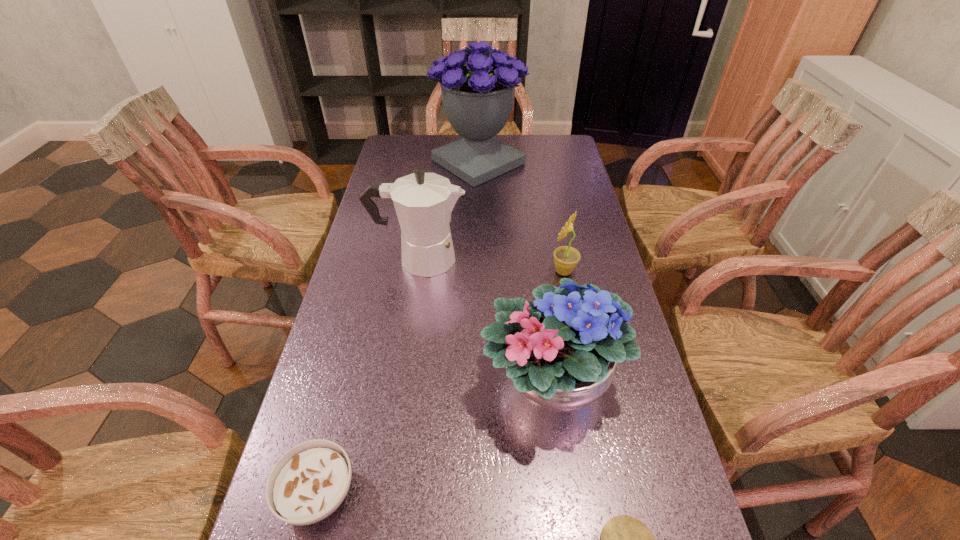
The image size is (960, 540). I want to click on blank area located 0.230m on the left of the nearer bouquet, so pyautogui.click(x=377, y=380).

Locate an element on the screen. This screenshot has width=960, height=540. vacant space located 0.370m on the face of the sunflower is located at coordinates (418, 272).

You are a GUI agent. You are given a task and a screenshot of the screen. Output one action in this format:
    pyautogui.click(x=<x>, y=<y>)
    Task: Click on the free spot located 0.270m on the face of the sunflower
    Image resolution: width=960 pixels, height=540 pixels.
    Given the screenshot: What is the action you would take?
    pyautogui.click(x=453, y=272)

I want to click on free space located 0.260m on the face of the sunflower, so click(457, 272).

At what (x,y) coordinates should I click in order to perform the action: click on free space located on the back of the second nearest object. Please return your answer as a coordinate pair (x, y). Looking at the image, I should click on (366, 303).

The image size is (960, 540). I want to click on object present at the far edge, so click(x=478, y=83).

This screenshot has height=540, width=960. Find the location of `coffeepot present at the left edge`. coffeepot present at the left edge is located at coordinates (423, 202).

This screenshot has width=960, height=540. I want to click on soup bowl situated at the left edge, so click(309, 482).

Where is `bouquet at the right edge`? This screenshot has height=540, width=960. bouquet at the right edge is located at coordinates (561, 354).

This screenshot has width=960, height=540. Identify the location of sunflower positioned at the right edge. (566, 258).